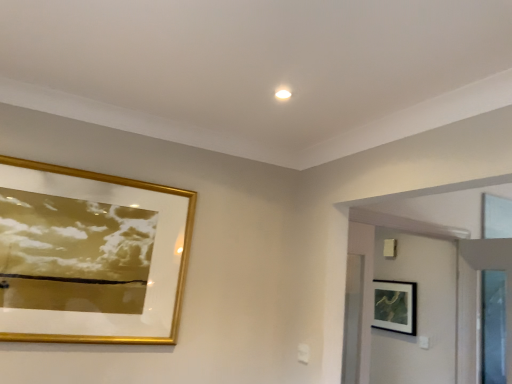
Question: Is black matte picture frame at upper right, which ranks as the 2th picture frame in front-to-back order, to the right of gold/glass picture frame at upper left, acting as the 1th picture frame starting from the front, from the viewer's perspective?

Choices:
 (A) yes
 (B) no

Answer: (A)

Question: Is black matte picture frame at upper right, the 2th picture frame in the top-to-bottom sequence, surrounding gold/glass picture frame at upper left, positioned as the first picture frame in left-to-right order?

Choices:
 (A) yes
 (B) no

Answer: (B)

Question: Is black matte picture frame at upper right, which ranks as the 2th picture frame in front-to-back order, turned away from gold/glass picture frame at upper left, positioned as the first picture frame in left-to-right order?

Choices:
 (A) yes
 (B) no

Answer: (B)

Question: Is black matte picture frame at upper right, which ranks as the 2th picture frame in front-to-back order, positioned far away from gold/glass picture frame at upper left, positioned as the first picture frame in left-to-right order?

Choices:
 (A) no
 (B) yes

Answer: (B)

Question: From a real-world perspective, is black matte picture frame at upper right, which appears as the 1th picture frame when viewed from the right, on top of gold/glass picture frame at upper left, which appears as the 1th picture frame when viewed from the top?

Choices:
 (A) no
 (B) yes

Answer: (A)

Question: Considering the positions of white glossy door at upper right and gold/glass picture frame at upper left, marked as the 2th picture frame in a back-to-front arrangement, in the image, is white glossy door at upper right taller or shorter than gold/glass picture frame at upper left, marked as the 2th picture frame in a back-to-front arrangement,?

Choices:
 (A) tall
 (B) short

Answer: (A)

Question: Which is correct: white glossy door at upper right is inside gold/glass picture frame at upper left, acting as the 1th picture frame starting from the front, or outside of it?

Choices:
 (A) outside
 (B) inside

Answer: (A)

Question: Is white glossy door at upper right to the left or to the right of gold/glass picture frame at upper left, positioned as the first picture frame in left-to-right order, in the image?

Choices:
 (A) right
 (B) left

Answer: (A)

Question: Considering the positions of white glossy door at upper right and gold/glass picture frame at upper left, acting as the 1th picture frame starting from the front, in the image, is white glossy door at upper right bigger or smaller than gold/glass picture frame at upper left, acting as the 1th picture frame starting from the front,?

Choices:
 (A) small
 (B) big

Answer: (B)

Question: Is point (125, 279) positioned closer to the camera than point (443, 316)?

Choices:
 (A) farther
 (B) closer

Answer: (B)

Question: From the image's perspective, is gold/glass picture frame at upper left, which is counted as the 2th picture frame, starting from the bottom, located above or below white glossy door at upper right?

Choices:
 (A) below
 (B) above

Answer: (B)

Question: Is gold/glass picture frame at upper left, which appears as the 1th picture frame when viewed from the top, bigger or smaller than white glossy door at upper right?

Choices:
 (A) small
 (B) big

Answer: (A)

Question: In terms of width, does gold/glass picture frame at upper left, which is counted as the 2th picture frame, starting from the bottom, look wider or thinner when compared to white glossy door at upper right?

Choices:
 (A) wide
 (B) thin

Answer: (B)

Question: In terms of height, does black matte picture frame at upper right, which ranks as the 2th picture frame in front-to-back order, look taller or shorter compared to white glossy door at upper right?

Choices:
 (A) tall
 (B) short

Answer: (B)

Question: In the image, is black matte picture frame at upper right, the 2th picture frame in the top-to-bottom sequence, positioned in front of or behind white glossy door at upper right?

Choices:
 (A) front
 (B) behind

Answer: (B)